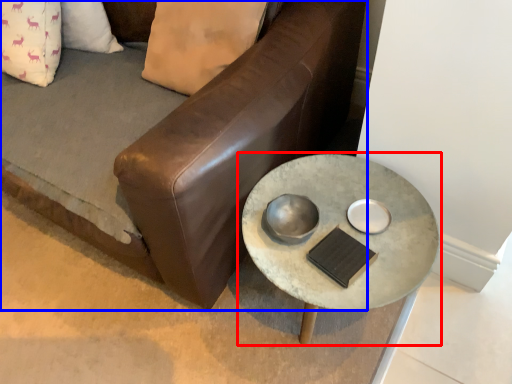
Question: Which of the following is the farthest to the observer, table (highlighted by a red box) or studio couch (highlighted by a blue box)?

Choices:
 (A) table
 (B) studio couch

Answer: (A)